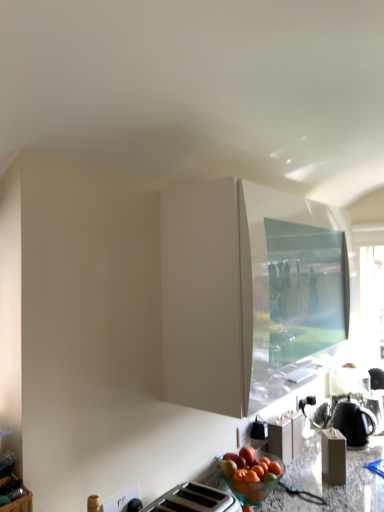
Question: Does black matte kettle at lower right have a lesser width compared to white glossy cabinet at upper center?

Choices:
 (A) yes
 (B) no

Answer: (A)

Question: Is white glossy cabinet at upper center completely or partially inside black matte kettle at lower right?

Choices:
 (A) yes
 (B) no

Answer: (B)

Question: From a real-world perspective, is black matte kettle at lower right below white glossy cabinet at upper center?

Choices:
 (A) no
 (B) yes

Answer: (B)

Question: Does black matte kettle at lower right have a larger size compared to white glossy cabinet at upper center?

Choices:
 (A) no
 (B) yes

Answer: (A)

Question: Does black matte kettle at lower right come in front of white glossy cabinet at upper center?

Choices:
 (A) yes
 (B) no

Answer: (B)

Question: From a real-world perspective, is black matte kettle at lower right over white glossy cabinet at upper center?

Choices:
 (A) no
 (B) yes

Answer: (A)

Question: Is white glossy cabinet at upper center facing away from black matte kettle at lower right?

Choices:
 (A) yes
 (B) no

Answer: (B)

Question: Is white glossy cabinet at upper center positioned before black matte kettle at lower right?

Choices:
 (A) yes
 (B) no

Answer: (A)

Question: Does white glossy cabinet at upper center have a greater height compared to black matte kettle at lower right?

Choices:
 (A) no
 (B) yes

Answer: (B)

Question: Is white glossy cabinet at upper center beside black matte kettle at lower right?

Choices:
 (A) no
 (B) yes

Answer: (A)

Question: Can you confirm if white glossy cabinet at upper center is positioned to the right of black matte kettle at lower right?

Choices:
 (A) no
 (B) yes

Answer: (A)

Question: Is white glossy cabinet at upper center surrounding black matte kettle at lower right?

Choices:
 (A) yes
 (B) no

Answer: (B)

Question: From a real-world perspective, is black matte kettle at lower right above or below white glossy cabinet at upper center?

Choices:
 (A) below
 (B) above

Answer: (A)